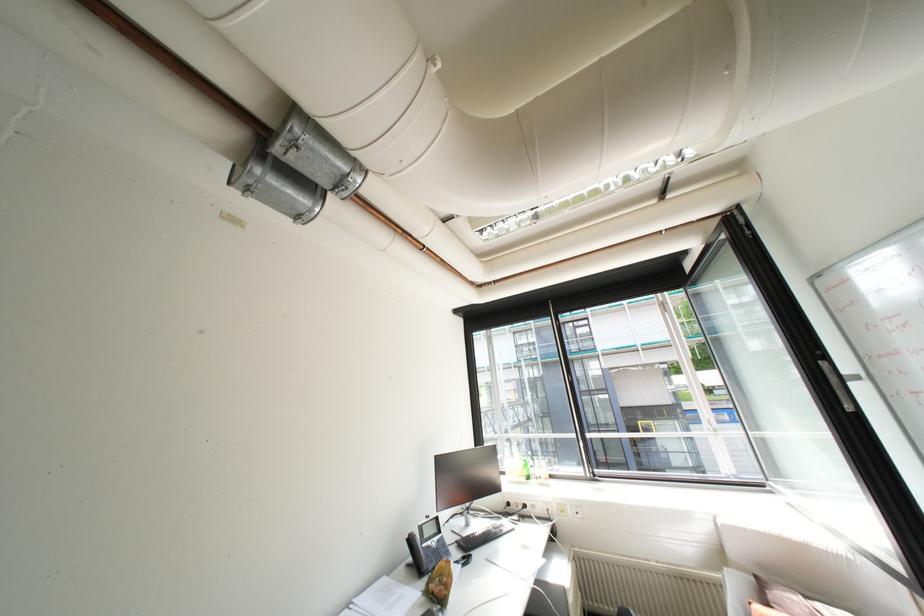
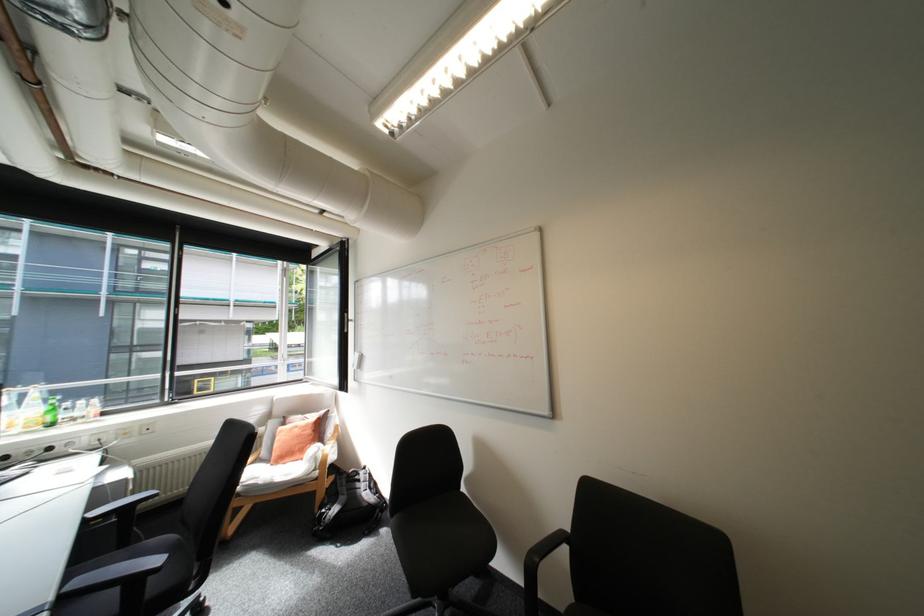
Find the pixel in the second image that matches point (531, 464) in the first image.

(55, 408)